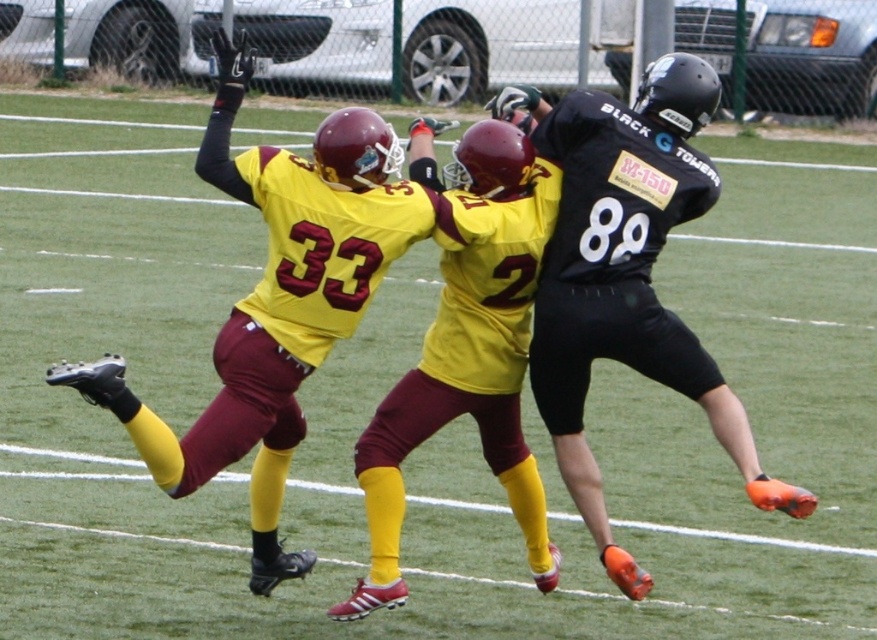
Locate an element on the screen. The image size is (877, 640). black matte jersey at center is located at coordinates (626, 275).

Does black matte jersey at center appear under maroon jersey at center?

Incorrect, black matte jersey at center is not positioned below maroon jersey at center.

Is point (788, 492) in front of point (510, 324)?

That is True.

Locate an element on the screen. The height and width of the screenshot is (640, 877). black matte jersey at center is located at coordinates (626, 275).